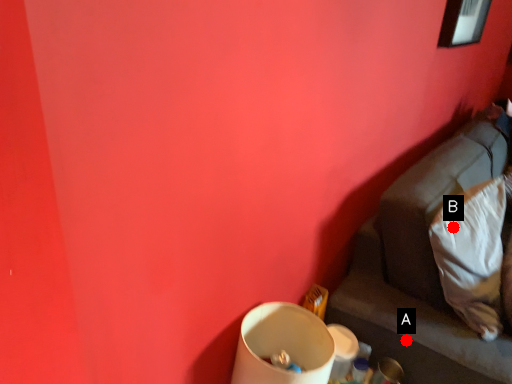
Question: Two points are circled on the image, labeled by A and B beside each circle. Which point is farther from the camera taking this photo?

Choices:
 (A) A is further
 (B) B is further

Answer: (A)